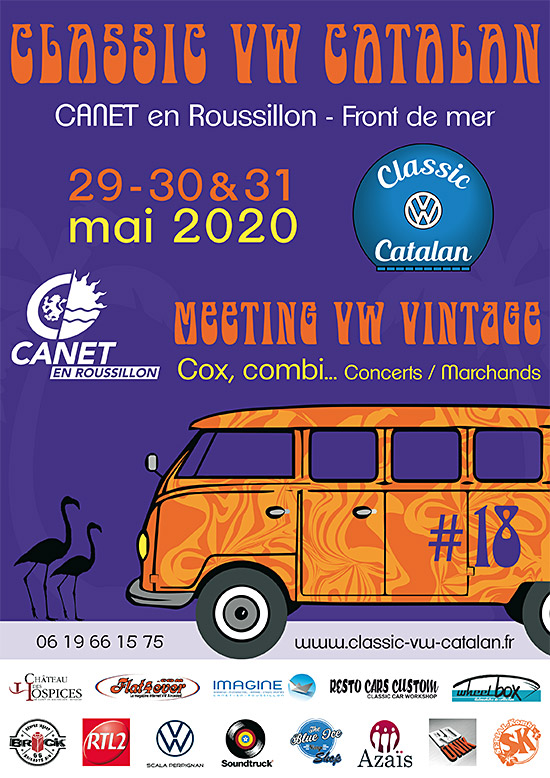
This screenshot has height=778, width=550. I want to click on door handle, so click(365, 510), click(280, 509).